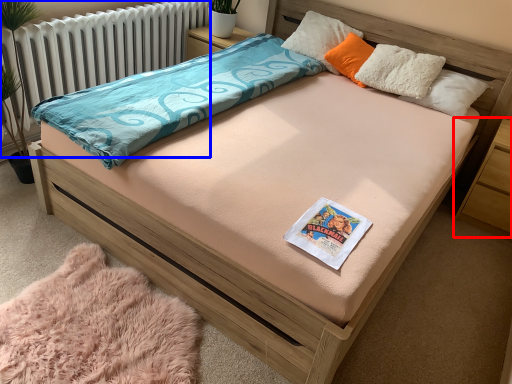
Question: Among these objects, which one is nearest to the camera, nightstand (highlighted by a red box) or radiator (highlighted by a blue box)?

Choices:
 (A) nightstand
 (B) radiator

Answer: (B)